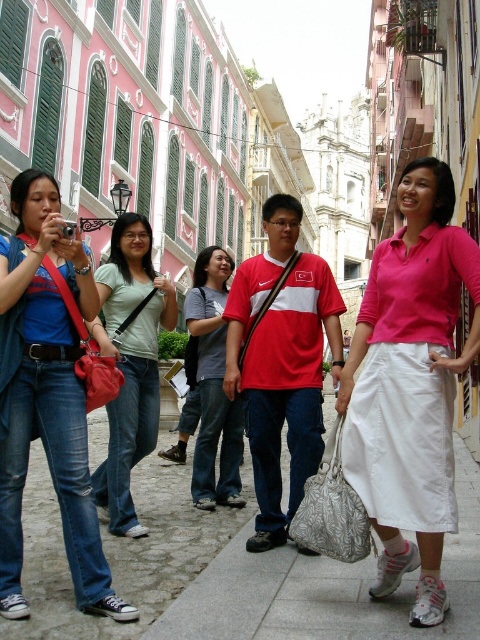
Question: Which is nearer to the light green cotton shirt at center?

Choices:
 (A) silver textured handbag at center
 (B) denim jeans at left
 (C) pink cotton polo shirt at center

Answer: (B)

Question: Among these points, which one is farthest from the camera?

Choices:
 (A) (13, 189)
 (B) (239, 532)
 (C) (368, 540)
 (D) (99, 509)

Answer: (D)

Question: Which object is positioned farthest from the denim jeans at left?

Choices:
 (A) silver textured handbag at center
 (B) light green cotton shirt at center

Answer: (A)

Question: Is pink cotton polo shirt at center below denim jeans at left?

Choices:
 (A) yes
 (B) no

Answer: (B)

Question: Does denim jeans at left appear on the left side of gray cotton shirt at center?

Choices:
 (A) yes
 (B) no

Answer: (A)

Question: Is white tile pavement at lower center above light green cotton shirt at center?

Choices:
 (A) no
 (B) yes

Answer: (A)